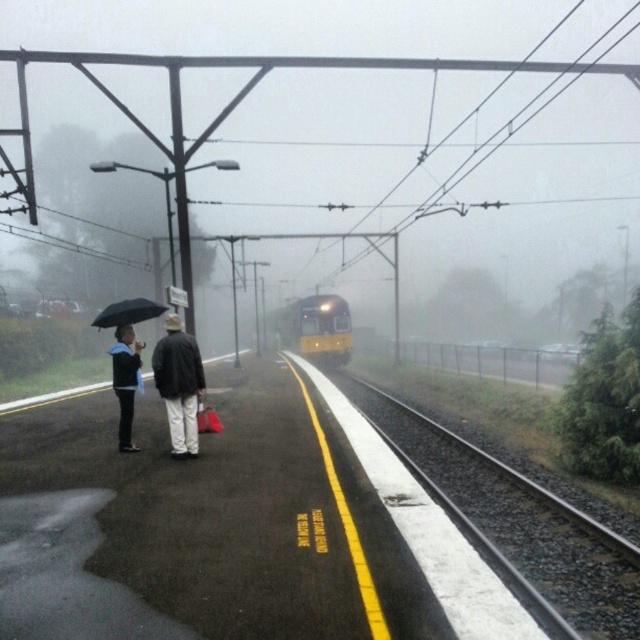
Does matte black umbrella at left appear under yellow metallic train at center?

Correct, matte black umbrella at left is located below yellow metallic train at center.

Between matte black umbrella at left and yellow metallic train at center, which one is positioned lower?

matte black umbrella at left is lower down.

Is point (170, 317) positioned in front of point (330, 349)?

Yes, point (170, 317) is closer to viewer.

Where is `matte black umbrella at left`? matte black umbrella at left is located at coordinates (179, 385).

Can you confirm if dark gray fabric jacket at center is positioned to the left of matte black jacket at left?

Incorrect, dark gray fabric jacket at center is not on the left side of matte black jacket at left.

Is dark gray fabric jacket at center further to camera compared to matte black jacket at left?

That is False.

This screenshot has height=640, width=640. What do you see at coordinates (179, 385) in the screenshot?
I see `dark gray fabric jacket at center` at bounding box center [179, 385].

Where is `dark gray fabric jacket at center`? dark gray fabric jacket at center is located at coordinates (179, 385).

Who is shorter, smooth steel train track at center or matte black umbrella at left?

Standing shorter between the two is smooth steel train track at center.

Between smooth steel train track at center and matte black umbrella at left, which one is positioned lower?

smooth steel train track at center is lower down.

Is point (488, 465) behind point (179, 440)?

Yes, point (488, 465) is farther from viewer.

Locate an element on the screen. smooth steel train track at center is located at coordinates (518, 525).